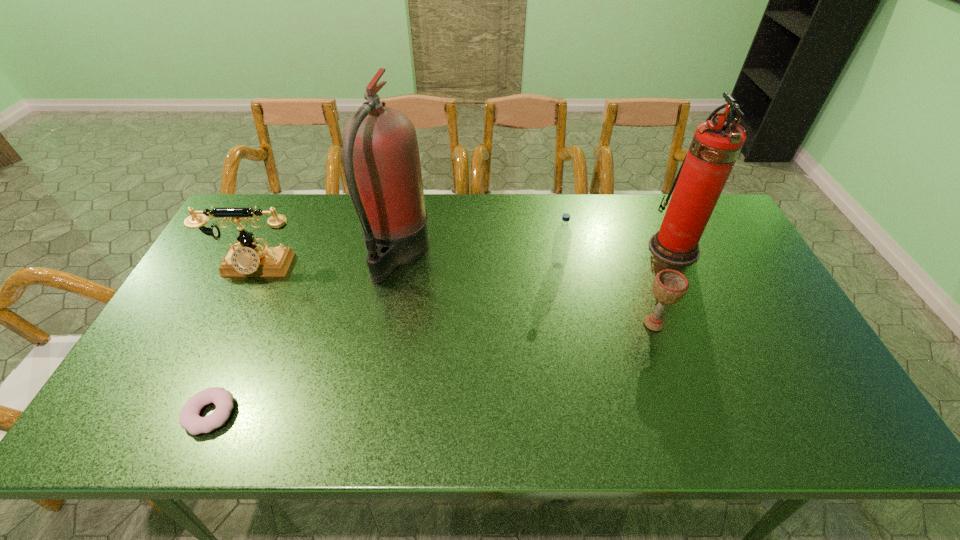
Where is `unoccupied position between the right fire extinguisher and the doughnut`? The width and height of the screenshot is (960, 540). unoccupied position between the right fire extinguisher and the doughnut is located at coordinates (442, 330).

Identify the location of blank region between the fourth object from right to left and the rightmost object. Image resolution: width=960 pixels, height=540 pixels. (535, 251).

Find the location of a particular element. blank region between the second object from right to left and the shortest object is located at coordinates (432, 369).

You are a GUI agent. You are given a task and a screenshot of the screen. Output one action in this format:
    pyautogui.click(x=<x>, y=<y>)
    Task: Click on the vacant area that lies between the left fire extinguisher and the shortest object
    
    Given the screenshot: What is the action you would take?
    point(303,333)

Image resolution: width=960 pixels, height=540 pixels. Identify the location of free space between the left fire extinguisher and the fourth object from left to right. 477,259.

You are a GUI agent. You are given a task and a screenshot of the screen. Output one action in this format:
    pyautogui.click(x=<x>, y=<y>)
    Task: Click on the object that is the fourth closest to the telephone
    The height and width of the screenshot is (540, 960).
    Given the screenshot: What is the action you would take?
    pyautogui.click(x=670, y=286)

Find the location of `object that can be found as the closest to the fourth object from left to right`. object that can be found as the closest to the fourth object from left to right is located at coordinates (670, 286).

Locate an element on the screen. free spot that satisfies the following two spatial constraints: 1. on the dial of the second nearest object; 2. on the right side of the telephone is located at coordinates point(228,323).

Identify the location of free space that satisfies the following two spatial constraints: 1. on the dial of the chalice; 2. on the right side of the telephone. Image resolution: width=960 pixels, height=540 pixels. [228, 323].

At what (x,y) coordinates should I click in order to perform the action: click on free location that satisfies the following two spatial constraints: 1. on the dial of the telephone; 2. on the right side of the fifth farthest object. Please return your answer as a coordinate pair (x, y). Looking at the image, I should click on (228, 323).